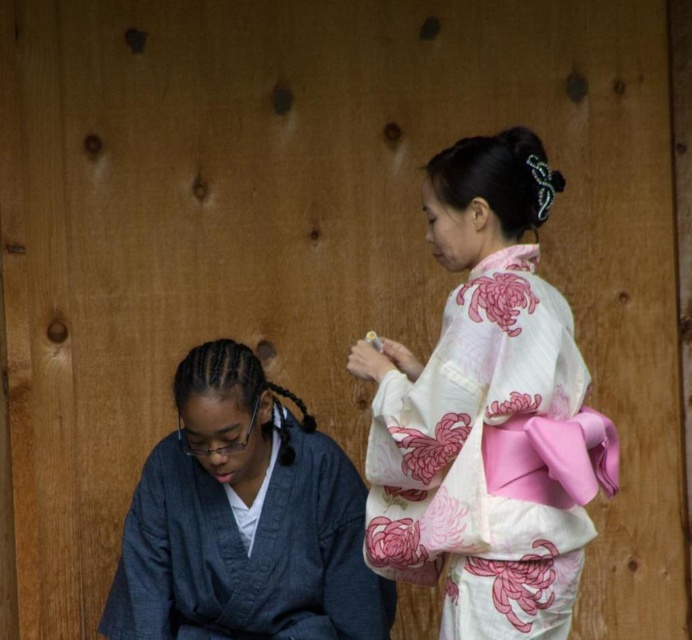
Who is shorter, white floral kimono at right or denim robe at lower left?

With less height is denim robe at lower left.

Describe the element at coordinates (486, 412) in the screenshot. I see `white floral kimono at right` at that location.

Image resolution: width=692 pixels, height=640 pixels. I want to click on white floral kimono at right, so [486, 412].

The height and width of the screenshot is (640, 692). I want to click on white floral kimono at right, so click(x=486, y=412).